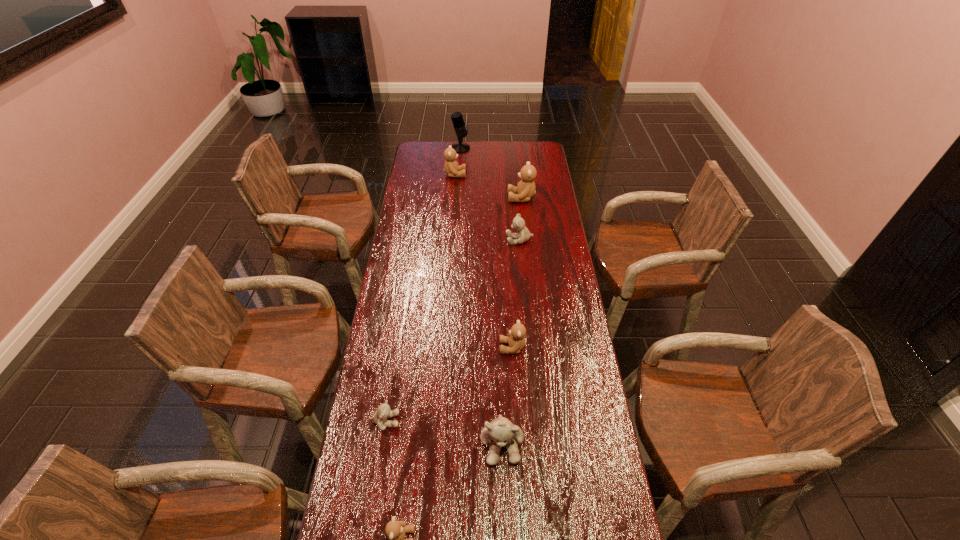
Identify the location of vacant space situated on the front-facing side of the third biggest brown teddy bear. (417, 348).

At what (x,y) coordinates should I click in order to perform the action: click on vacant space located on the front-facing side of the third biggest brown teddy bear. Please return your answer as a coordinate pair (x, y). Looking at the image, I should click on (434, 348).

This screenshot has width=960, height=540. I want to click on free point located 0.070m on the face of the second biggest gray teddy bear, so click(x=490, y=240).

In order to click on free space located on the face of the second biggest gray teddy bear in this screenshot , I will do `click(442, 240)`.

The width and height of the screenshot is (960, 540). I want to click on free region located 0.250m on the face of the second biggest gray teddy bear, so coord(449,240).

At what (x,y) coordinates should I click in order to perform the action: click on free point located on the face of the leftmost object. Please return your answer as a coordinate pair (x, y). This screenshot has width=960, height=540. Looking at the image, I should click on (530, 421).

What are the coordinates of `object that is positioned at the far edge` in the screenshot? It's located at (457, 119).

Find the location of a particular element. This screenshot has height=540, width=960. object that is positioned at the left edge is located at coordinates (383, 412).

This screenshot has width=960, height=540. Identify the location of vacant space at the far edge. (511, 157).

Find the location of a particular element. The width and height of the screenshot is (960, 540). vacant space at the left edge is located at coordinates (429, 166).